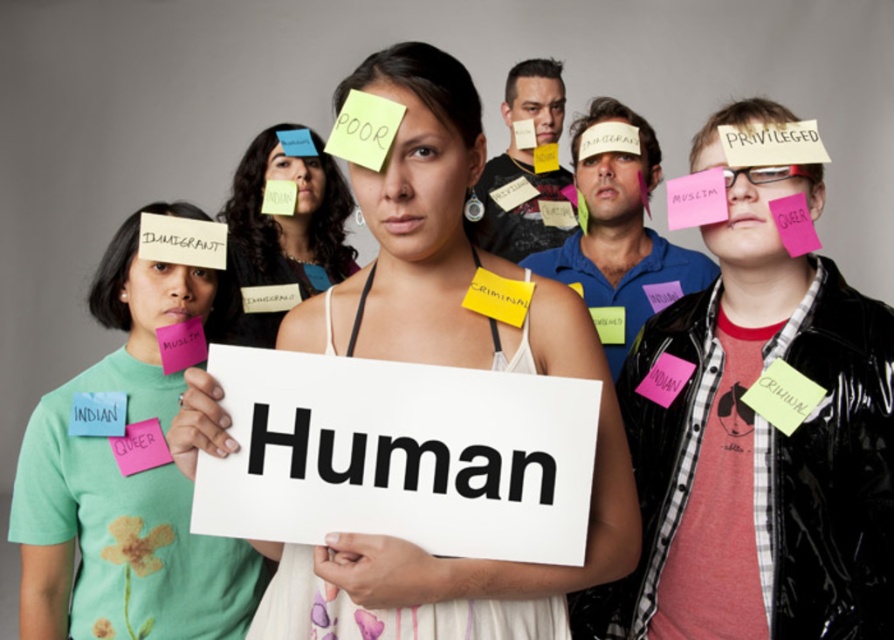
Between white fabric sign at center and green t-shirt at left, which one is positioned lower?

green t-shirt at left is lower down.

Measure the distance between point (x=549, y=580) and camera.

37.60 inches

At what (x,y) coordinates should I click in order to perform the action: click on white fabric sign at center. Please return your answer as a coordinate pair (x, y). Looking at the image, I should click on (443, 364).

Is green t-shirt at left to the left of matte paper sign at center from the viewer's perspective?

Indeed, green t-shirt at left is positioned on the left side of matte paper sign at center.

Which is in front, point (83, 518) or point (234, 296)?

Positioned in front is point (83, 518).

Where is `green t-shirt at left`? The width and height of the screenshot is (894, 640). green t-shirt at left is located at coordinates (125, 483).

What do you see at coordinates (443, 364) in the screenshot? I see `white fabric sign at center` at bounding box center [443, 364].

Find the location of a particular element. white fabric sign at center is located at coordinates (443, 364).